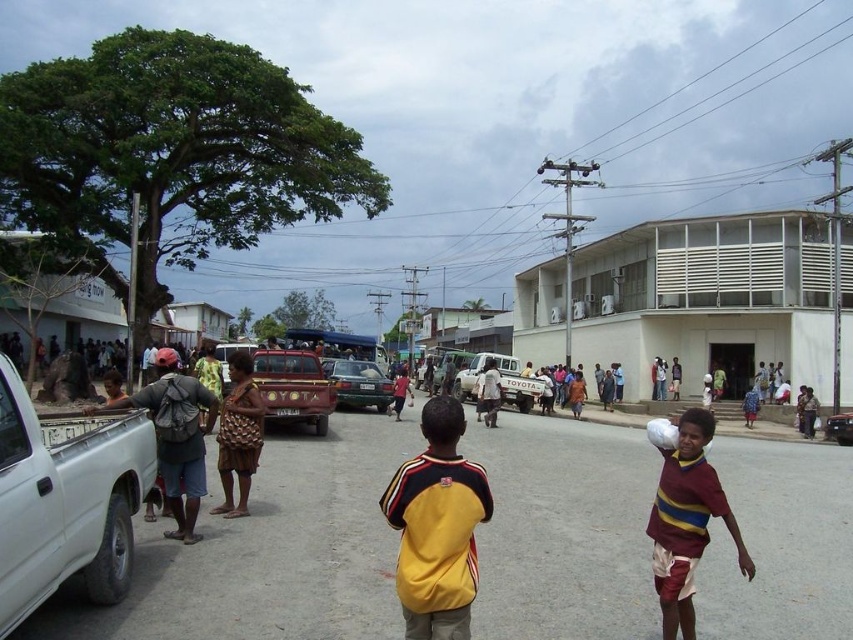
Question: Is green matte car at center positioned behind metallic red car at center?

Choices:
 (A) no
 (B) yes

Answer: (A)

Question: Which object appears farthest from the camera in this image?

Choices:
 (A) yellow striped shirt at center
 (B) white matte truck at center

Answer: (B)

Question: Is green matte car at center in front of metallic red car at center?

Choices:
 (A) yes
 (B) no

Answer: (A)

Question: Is yellow striped shirt at center below maroon striped shirt at center?

Choices:
 (A) no
 (B) yes

Answer: (A)

Question: Among these objects, which one is nearest to the camera?

Choices:
 (A) yellow striped shirt at center
 (B) metallic red car at center

Answer: (A)

Question: Among these objects, which one is farthest from the camera?

Choices:
 (A) white matte truck at center
 (B) yellow striped shirt at center

Answer: (A)